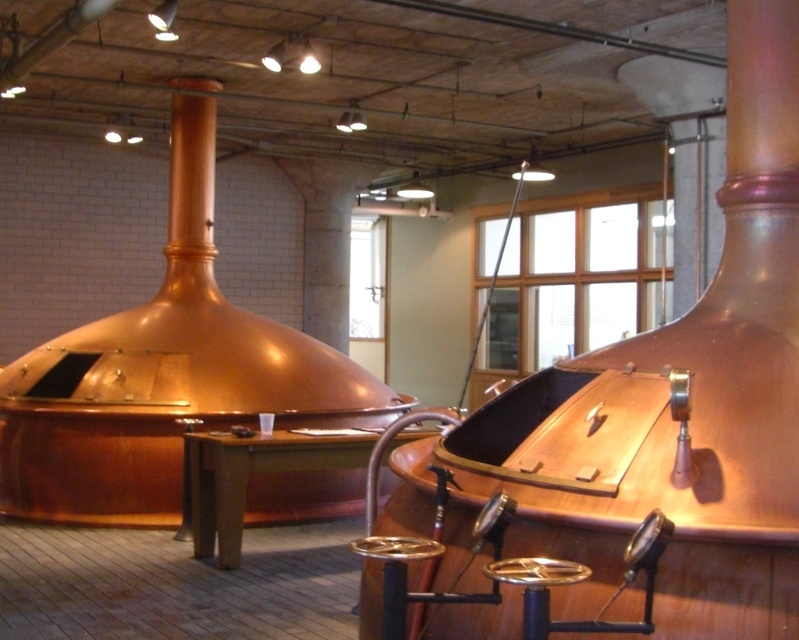
Question: Does metallic stool at center have a smaller size compared to shiny metallic stool at center?

Choices:
 (A) yes
 (B) no

Answer: (B)

Question: Does metallic stool at center lie behind shiny metallic stool at center?

Choices:
 (A) no
 (B) yes

Answer: (B)

Question: Which object appears farthest from the camera in this image?

Choices:
 (A) metallic stool at center
 (B) shiny metallic stool at center

Answer: (A)

Question: Is metallic stool at center to the left of shiny metallic stool at center from the viewer's perspective?

Choices:
 (A) yes
 (B) no

Answer: (A)

Question: Which point is closer to the camera?

Choices:
 (A) metallic stool at center
 (B) shiny metallic stool at center

Answer: (B)